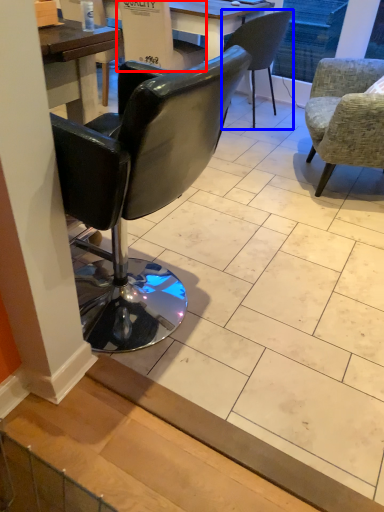
Question: Among these objects, which one is farthest to the camera, armchair (highlighted by a red box) or chair (highlighted by a blue box)?

Choices:
 (A) armchair
 (B) chair

Answer: (B)